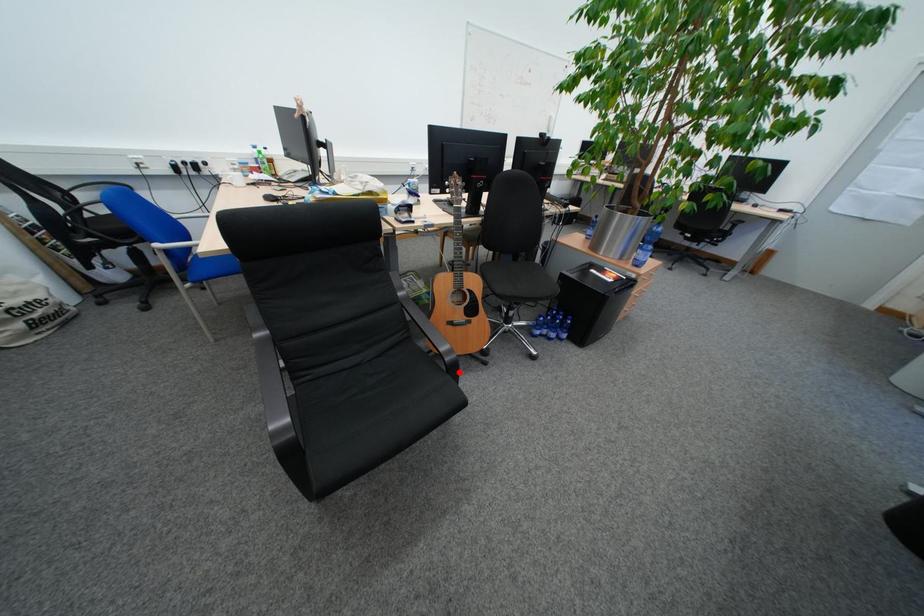
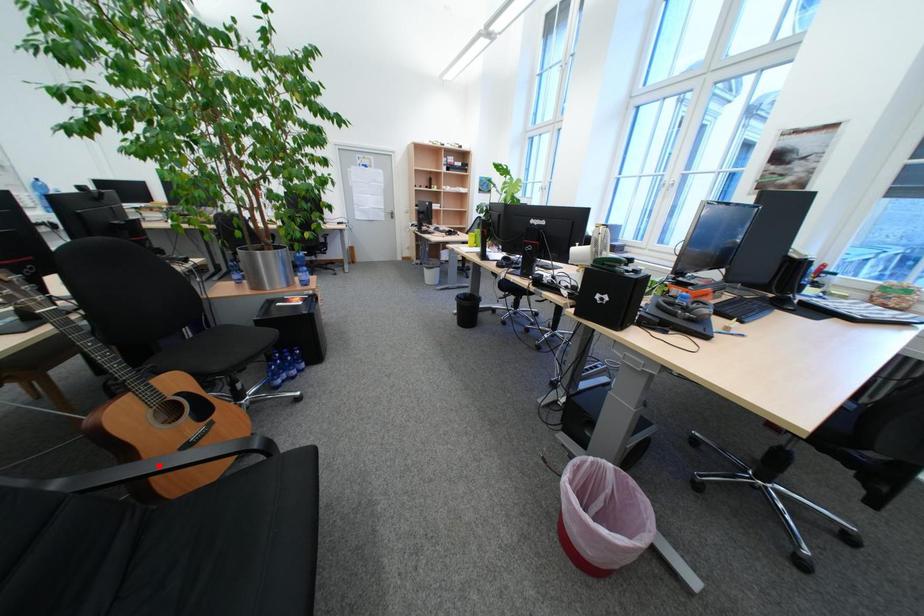
I am providing you with two images of the same scene from different viewpoints. A red point is marked on the first image and another point is marked on the second image. Is the marked point in image1 the same physical position as the marked point in image2?

No